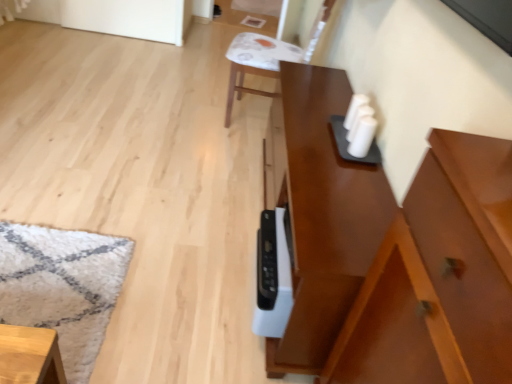
The width and height of the screenshot is (512, 384). In order to click on vacant region to the left of white fabric chair at upper center in this screenshot , I will do `click(189, 103)`.